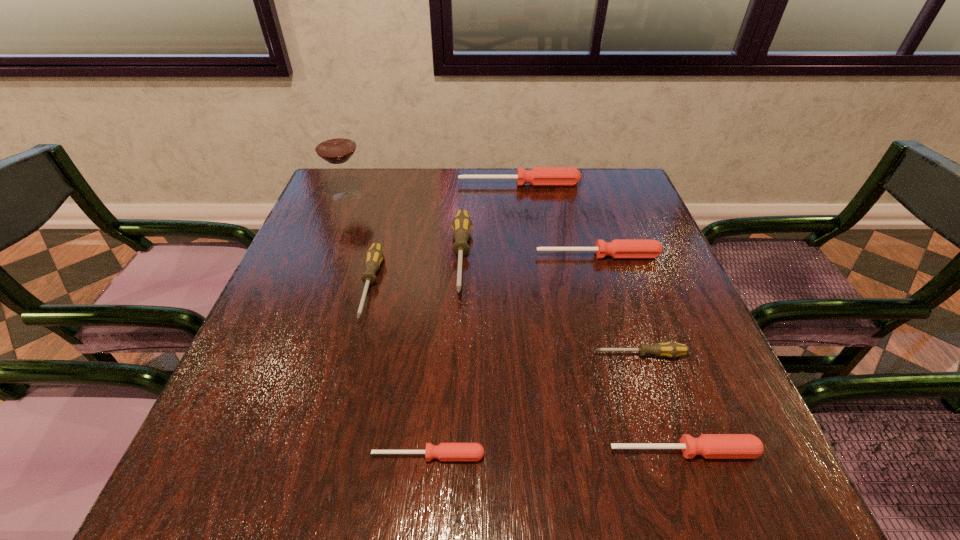
Locate an element on the screen. The width and height of the screenshot is (960, 540). vacant space positioned at the tip of the rightmost gray screwdriver is located at coordinates (480, 355).

Where is `vacant area situated at the tip of the rightmost gray screwdriver`? vacant area situated at the tip of the rightmost gray screwdriver is located at coordinates (547, 355).

Identify the location of free space located on the back of the smallest red screwdriver. This screenshot has width=960, height=540. (440, 323).

Locate an element on the screen. wineglass at the far edge is located at coordinates (335, 144).

Where is `screwdriver present at the far edge`? Image resolution: width=960 pixels, height=540 pixels. screwdriver present at the far edge is located at coordinates (538, 176).

Locate an element on the screen. The width and height of the screenshot is (960, 540). object located at the left edge is located at coordinates (335, 144).

Identify the location of object that is at the far left corner. Image resolution: width=960 pixels, height=540 pixels. (335, 144).

The image size is (960, 540). What are the coordinates of `object that is at the far right corner` in the screenshot? It's located at (538, 176).

This screenshot has height=540, width=960. What are the coordinates of `object present at the near right corner` in the screenshot? It's located at 711,446.

This screenshot has height=540, width=960. I want to click on vacant space at the far edge, so click(x=464, y=190).